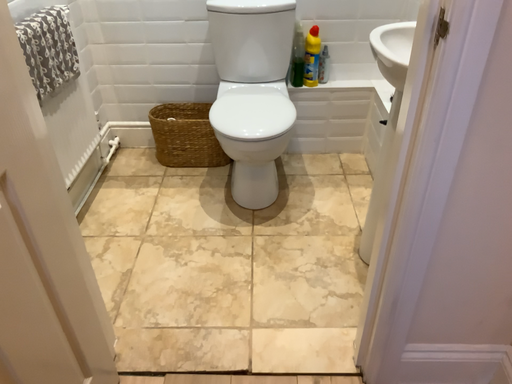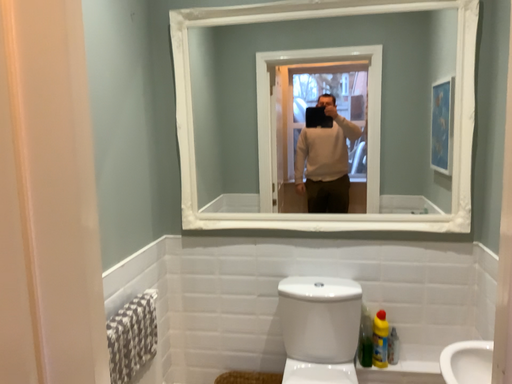
Question: How did the camera likely rotate when shooting the video?

Choices:
 (A) rotated left
 (B) rotated right

Answer: (A)